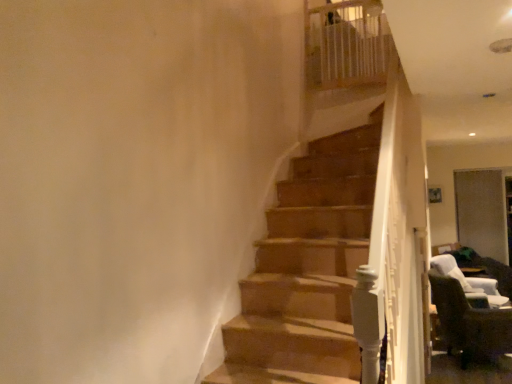
Question: Should I look upward or downward to see brown fabric chair at lower right, the second chair positioned from the back?

Choices:
 (A) up
 (B) down

Answer: (B)

Question: Can you confirm if white wicker chair at lower right, the 2th chair in the left-to-right sequence, is shorter than brown fabric chair at lower right, which is counted as the 2th chair, starting from the right?

Choices:
 (A) yes
 (B) no

Answer: (A)

Question: Can you confirm if white wicker chair at lower right, marked as the 1th chair in a right-to-left arrangement, is smaller than brown fabric chair at lower right, which is counted as the 2th chair, starting from the right?

Choices:
 (A) yes
 (B) no

Answer: (A)

Question: Is white wicker chair at lower right, the 2th chair in the left-to-right sequence, oriented towards brown fabric chair at lower right, which is counted as the 2th chair, starting from the right?

Choices:
 (A) no
 (B) yes

Answer: (A)

Question: Is white wicker chair at lower right, the second chair positioned from the front, positioned in front of brown fabric chair at lower right, the second chair positioned from the back?

Choices:
 (A) yes
 (B) no

Answer: (B)

Question: From a real-world perspective, is white wicker chair at lower right, which appears as the 1th chair when viewed from the back, below brown fabric chair at lower right, the first chair from the left?

Choices:
 (A) yes
 (B) no

Answer: (B)

Question: Is white wicker chair at lower right, which appears as the 1th chair when viewed from the back, outside of brown fabric chair at lower right, the first chair from the left?

Choices:
 (A) no
 (B) yes

Answer: (B)

Question: From the image's perspective, is brown fabric chair at lower right, the second chair positioned from the back, under white wicker chair at lower right, the second chair positioned from the front?

Choices:
 (A) yes
 (B) no

Answer: (A)

Question: From a real-world perspective, is brown fabric chair at lower right, the first chair from the left, positioned under white wicker chair at lower right, which appears as the 1th chair when viewed from the back, based on gravity?

Choices:
 (A) no
 (B) yes

Answer: (B)

Question: Considering the relative sizes of brown fabric chair at lower right, the first chair from the left, and white wicker chair at lower right, the second chair positioned from the front, in the image provided, is brown fabric chair at lower right, the first chair from the left, shorter than white wicker chair at lower right, the second chair positioned from the front,?

Choices:
 (A) yes
 (B) no

Answer: (B)

Question: Is brown fabric chair at lower right, which is counted as the 2th chair, starting from the right, directly adjacent to white wicker chair at lower right, which appears as the 1th chair when viewed from the back?

Choices:
 (A) no
 (B) yes

Answer: (A)

Question: Is brown fabric chair at lower right, the second chair positioned from the back, bigger than white wicker chair at lower right, marked as the 1th chair in a right-to-left arrangement?

Choices:
 (A) no
 (B) yes

Answer: (B)

Question: Is brown fabric chair at lower right, the second chair positioned from the back, closer to the viewer compared to white wicker chair at lower right, the second chair positioned from the front?

Choices:
 (A) yes
 (B) no

Answer: (A)

Question: In the image, is white wicker chair at lower right, marked as the 1th chair in a right-to-left arrangement, on the left side or the right side of brown fabric chair at lower right, positioned as the first chair in front-to-back order?

Choices:
 (A) left
 (B) right

Answer: (B)